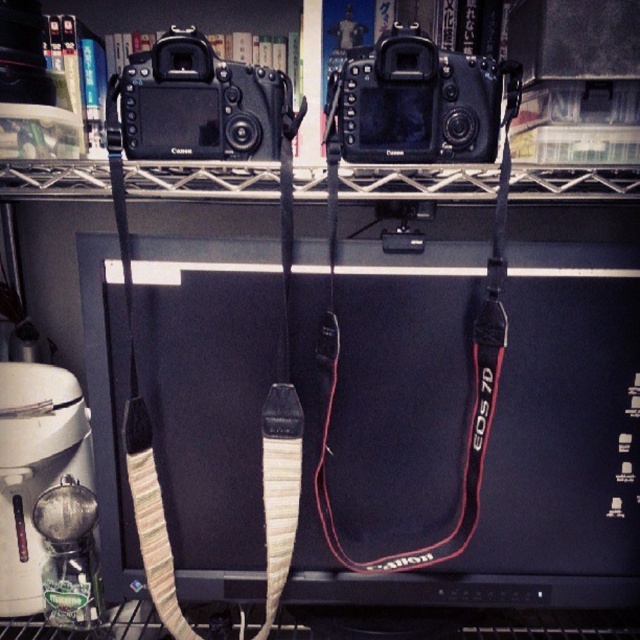
Question: Considering the relative positions of black matte camera at center and black matte camera at upper center in the image provided, where is black matte camera at center located with respect to black matte camera at upper center?

Choices:
 (A) right
 (B) left

Answer: (A)

Question: Is black matte camera at center thinner than black matte camera at upper center?

Choices:
 (A) no
 (B) yes

Answer: (B)

Question: Observing the image, what is the correct spatial positioning of black matte camera at center in reference to black matte camera at upper center?

Choices:
 (A) left
 (B) right

Answer: (B)

Question: Which object appears closest to the camera in this image?

Choices:
 (A) black matte camera at center
 (B) black matte camera at upper center

Answer: (A)

Question: Which of the following is the farthest from the observer?

Choices:
 (A) (209, 128)
 (B) (392, 97)

Answer: (A)